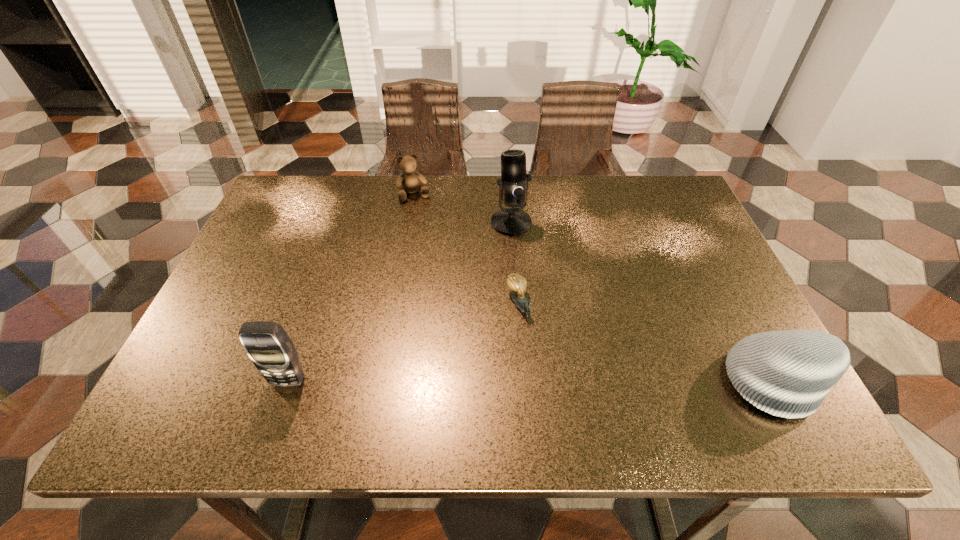
Identify the location of teddy bear present at the far edge. Image resolution: width=960 pixels, height=540 pixels. (408, 181).

I want to click on cellular telephone present at the near edge, so click(x=267, y=344).

This screenshot has height=540, width=960. I want to click on beanie that is at the near edge, so click(788, 373).

Find the location of a particular element. This screenshot has height=540, width=960. object positioned at the right edge is located at coordinates (788, 373).

Where is `object that is at the near right corner`? object that is at the near right corner is located at coordinates (788, 373).

What are the coordinates of `blank space at the far edge of the desktop` in the screenshot? It's located at (545, 197).

What are the coordinates of `vacant region at the near edge` in the screenshot? It's located at (663, 366).

Find the location of `vacant space at the left edge of the desktop`. vacant space at the left edge of the desktop is located at coordinates (230, 289).

This screenshot has height=540, width=960. In the image, there is a desktop. What are the coordinates of `vacant region at the right edge` in the screenshot? It's located at (689, 303).

Where is `free space at the far left corner of the desktop`? The width and height of the screenshot is (960, 540). free space at the far left corner of the desktop is located at coordinates (299, 204).